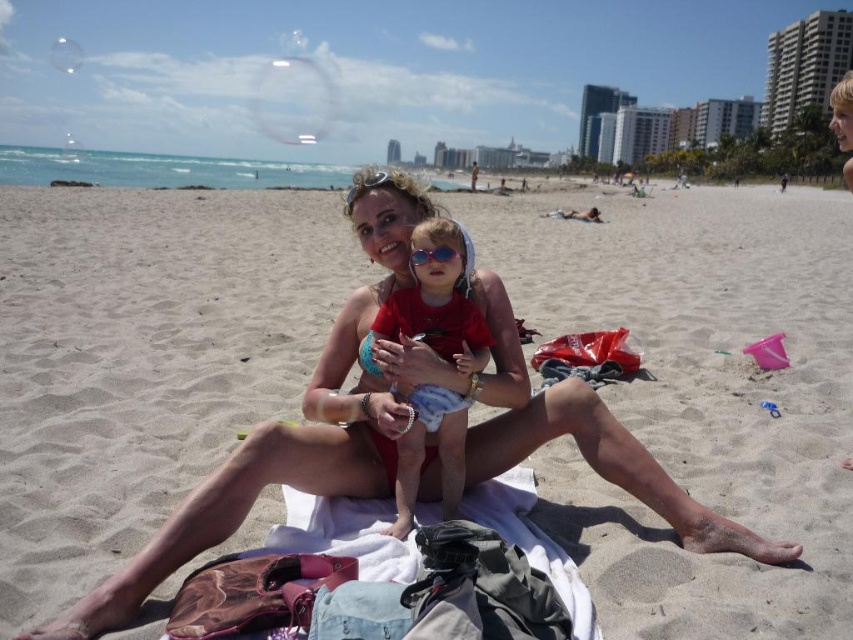
Based on the photo, is white sand towel at center in front of matte red swimsuit at center?

Yes, white sand towel at center is in front of matte red swimsuit at center.

Which is in front, point (361, 273) or point (444, 262)?

Point (444, 262) is more forward.

Which is behind, point (328, 298) or point (425, 403)?

Positioned behind is point (328, 298).

The image size is (853, 640). What are the coordinates of `white sand towel at center` in the screenshot? It's located at (154, 376).

Is white sand towel at center positioned in front of sunglasses at center?

Yes.

The image size is (853, 640). What are the coordinates of `white sand towel at center` in the screenshot? It's located at (154, 376).

Can you confirm if matte red swimsuit at center is positioned above sunglasses at center?

No, matte red swimsuit at center is not above sunglasses at center.

Is matte red swimsuit at center behind sunglasses at center?

Yes.

Does point (473, 365) come farther from viewer compared to point (422, 250)?

That is True.

Identify the location of matte red swimsuit at center. The image size is (853, 640). (437, 305).